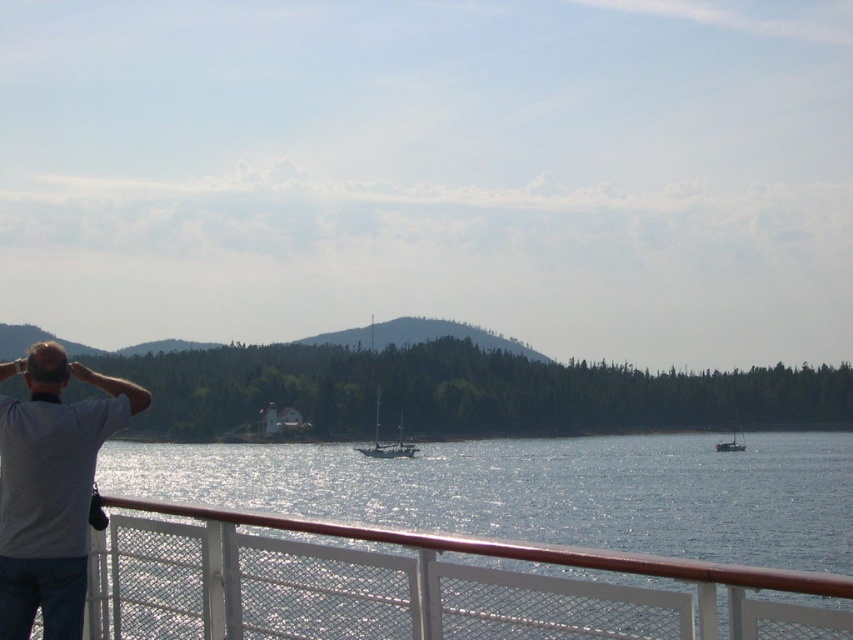
You are standing on the deck of a ship and want to know how far the clear water at lower center is from you. Can you determine the distance?

The clear water at lower center is 17.69 feet away from the viewer.

You are standing on the deck of a ship and want to move from the point at coordinates point (254, 509) to the point at coordinates point (0, 406). Which direction should you move to get closer to the latter point?

To move from point (254, 509) to point (0, 406), you should move diagonally towards the lower left direction since point (0, 406) is positioned to the lower left of point (254, 509).

You are standing on the deck of a ship and see a shiny silver sailboat at center. Where exactly is the shiny silver sailboat located in relation to the point marked at coordinates (386,442)?

The shiny silver sailboat at center is located exactly at the point marked at coordinates (386,442).